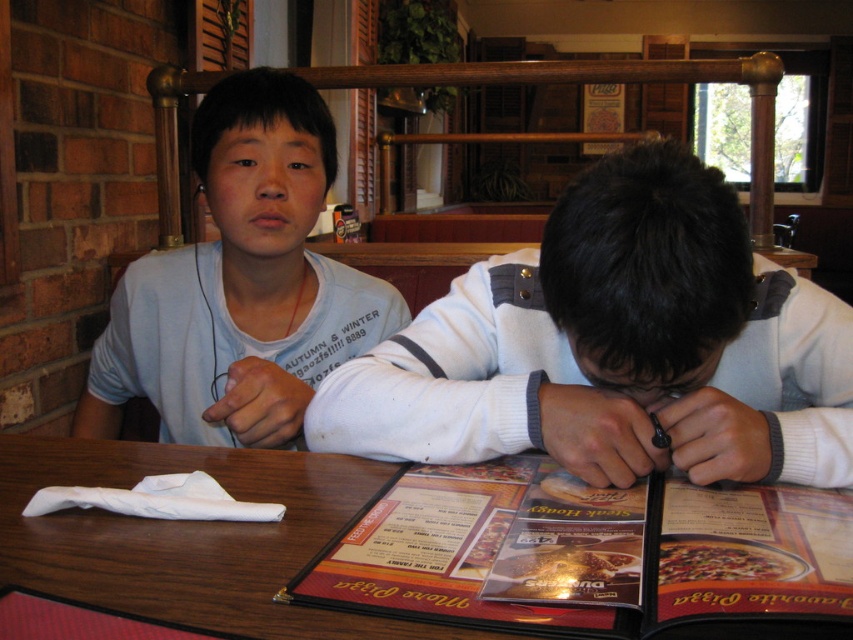
Is the position of matte plastic menu at center more distant than that of white cotton shirt at upper left?

That is False.

Who is higher up, matte plastic menu at center or white cotton shirt at upper left?

white cotton shirt at upper left is above.

Is point (790, 593) less distant than point (173, 307)?

Yes, it is.

Locate an element on the screen. matte plastic menu at center is located at coordinates (587, 552).

Is point (656, 326) positioned in front of point (352, 282)?

Yes, it is.

Does white knit sweater at center have a larger size compared to white cotton shirt at upper left?

No.

Is point (669, 266) positioned after point (170, 266)?

No, (669, 266) is in front of (170, 266).

Locate an element on the screen. The width and height of the screenshot is (853, 640). white knit sweater at center is located at coordinates (x=614, y=346).

Which of these two, white knit sweater at center or matte plastic menu at center, stands taller?

white knit sweater at center is taller.

Which is in front, point (810, 406) or point (682, 580)?

Positioned in front is point (682, 580).

Where is `white knit sweater at center`? white knit sweater at center is located at coordinates (614, 346).